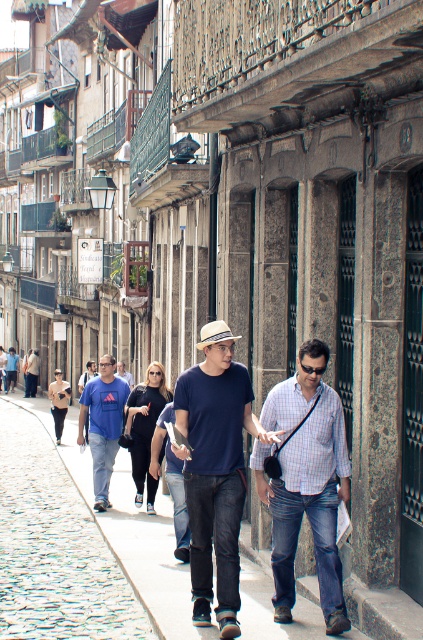
Question: Can you confirm if white felt fedora at center is thinner than blue cotton shirt at center?

Choices:
 (A) no
 (B) yes

Answer: (A)

Question: Which point is farther to the camera?

Choices:
 (A) cobblestone pavement at center
 (B) matte blue shirt at center
 (C) checkered shirt at center
 (D) white felt fedora at center

Answer: (D)

Question: Is matte blue shirt at center closer to the viewer compared to blue cotton t-shirt at center?

Choices:
 (A) yes
 (B) no

Answer: (A)

Question: Which point is farther from the camera taking this photo?

Choices:
 (A) (219, 340)
 (B) (91, 392)
 (C) (88, 468)
 (D) (123, 368)

Answer: (D)

Question: Is cobblestone pavement at center wider than blue cotton t-shirt at center?

Choices:
 (A) yes
 (B) no

Answer: (A)

Question: Which point is closer to the camera?

Choices:
 (A) (93, 448)
 (B) (230, 330)

Answer: (B)